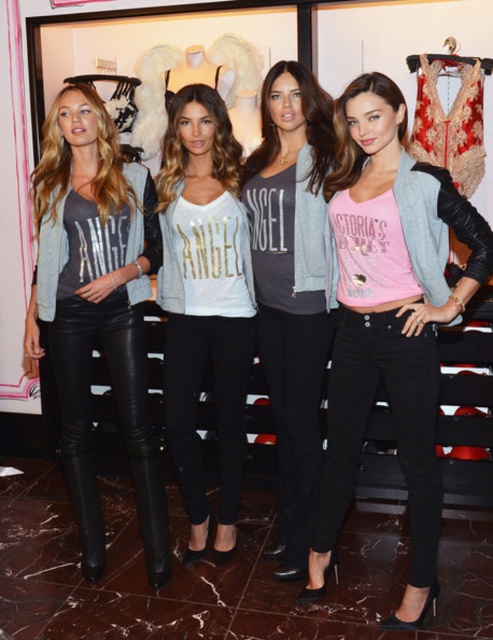
You are a stylist preparing to take a photo of the pink matte crop top at center and the white matte jersey at center. Based on their positions in the image, which one should you focus on first if you want to capture both items in a single frame without moving the camera?

The white matte jersey at center should be focused on first because it is positioned above the pink matte crop top at center, making it closer to the camera and easier to capture in the frame.

You are a photographer setting up for a shoot in the Victoria Secret store. You need to focus on the matte black leather pants at left and the white matte jersey at center. Which one is positioned lower in the scene?

The matte black leather pants at left are positioned below the white matte jersey at center, so they are lower in the scene.